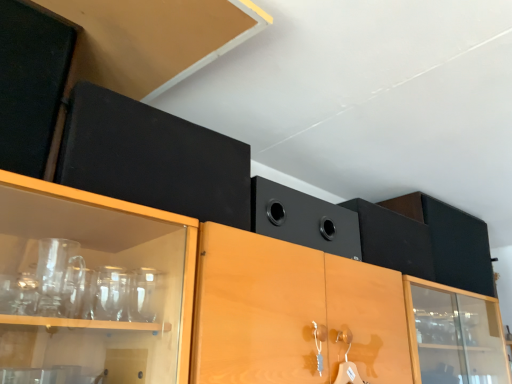
Question: From a real-world perspective, is black matte speaker at upper center above or below matte black cabinet at upper left?

Choices:
 (A) below
 (B) above

Answer: (A)

Question: Considering the positions of black matte speaker at upper center and matte black cabinet at upper left in the image, is black matte speaker at upper center bigger or smaller than matte black cabinet at upper left?

Choices:
 (A) small
 (B) big

Answer: (B)

Question: Would you say black matte speaker at upper center is to the left or to the right of matte black cabinet at upper left in the picture?

Choices:
 (A) right
 (B) left

Answer: (A)

Question: Is point (165, 157) positioned closer to the camera than point (330, 210)?

Choices:
 (A) closer
 (B) farther

Answer: (A)

Question: Considering the positions of matte black cabinet at upper left and black matte speaker at upper center in the image, is matte black cabinet at upper left wider or thinner than black matte speaker at upper center?

Choices:
 (A) thin
 (B) wide

Answer: (A)

Question: Is matte black cabinet at upper left bigger or smaller than black matte speaker at upper center?

Choices:
 (A) big
 (B) small

Answer: (B)

Question: Is matte black cabinet at upper left in front of or behind black matte speaker at upper center in the image?

Choices:
 (A) front
 (B) behind

Answer: (A)